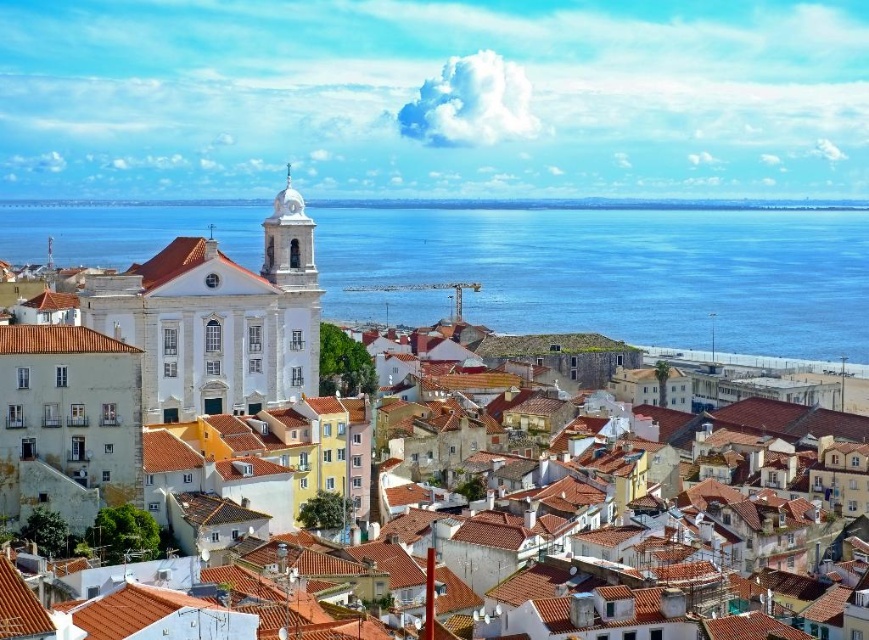
Is point (795, 260) farther from camera compared to point (833, 225)?

No, (795, 260) is closer to viewer.

Which of these two, blue water at center or white smooth church at upper center, stands shorter?

blue water at center is shorter.

Locate an element on the screen. The image size is (869, 640). blue water at center is located at coordinates (614, 273).